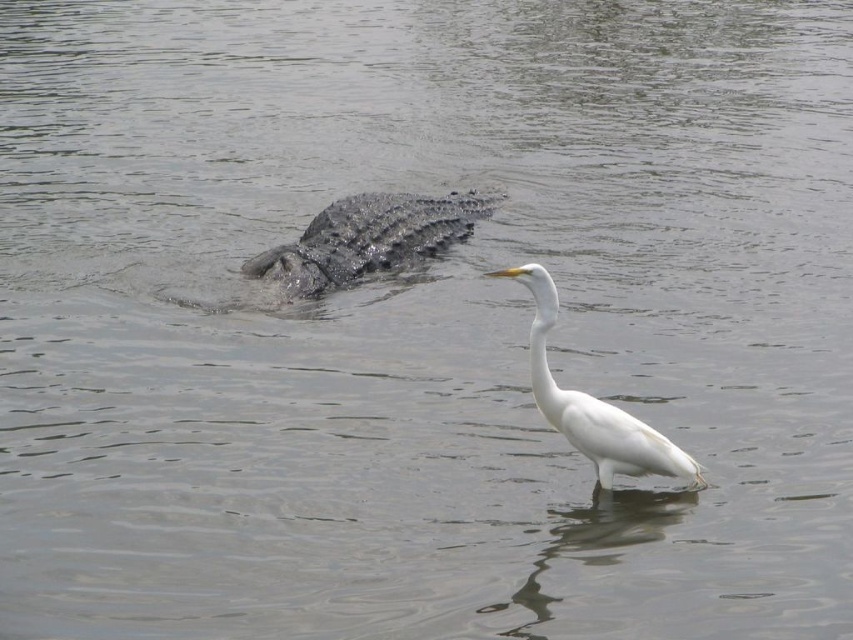
Does dark gray scaly crocodile at center have a larger size compared to white smooth bird at center?

Yes, dark gray scaly crocodile at center is bigger than white smooth bird at center.

Is point (439, 224) positioned before point (666, 468)?

No, it is behind (666, 468).

Who is more distant from viewer, (453,216) or (526,273)?

The point (453,216) is more distant.

In order to click on dark gray scaly crocodile at center in this screenshot , I will do `click(370, 237)`.